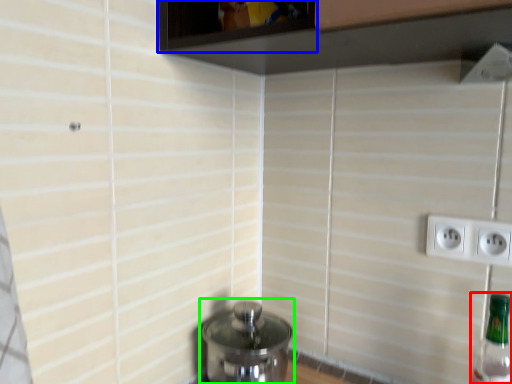
Question: Based on their relative distances, which object is nearer to bottle (highlighted by a red box)? Choose from window (highlighted by a blue box) and water heater (highlighted by a green box).

Choices:
 (A) window
 (B) water heater

Answer: (B)